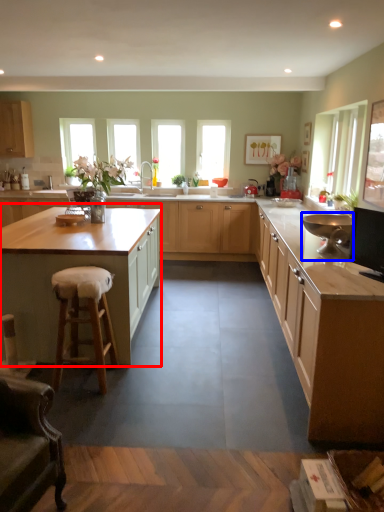
Question: Which of the following is the farthest to the observer, cabinetry (highlighted by a red box) or appliance (highlighted by a blue box)?

Choices:
 (A) cabinetry
 (B) appliance

Answer: (A)